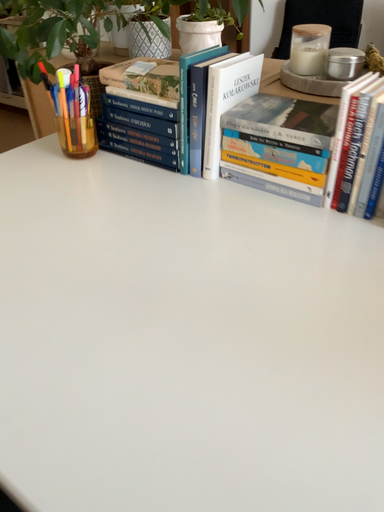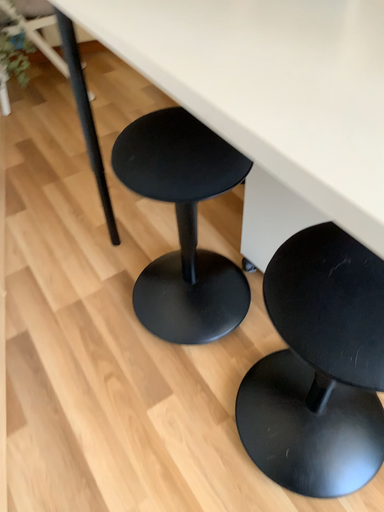
Question: Which way did the camera rotate in the video?

Choices:
 (A) rotated upward
 (B) rotated downward

Answer: (B)